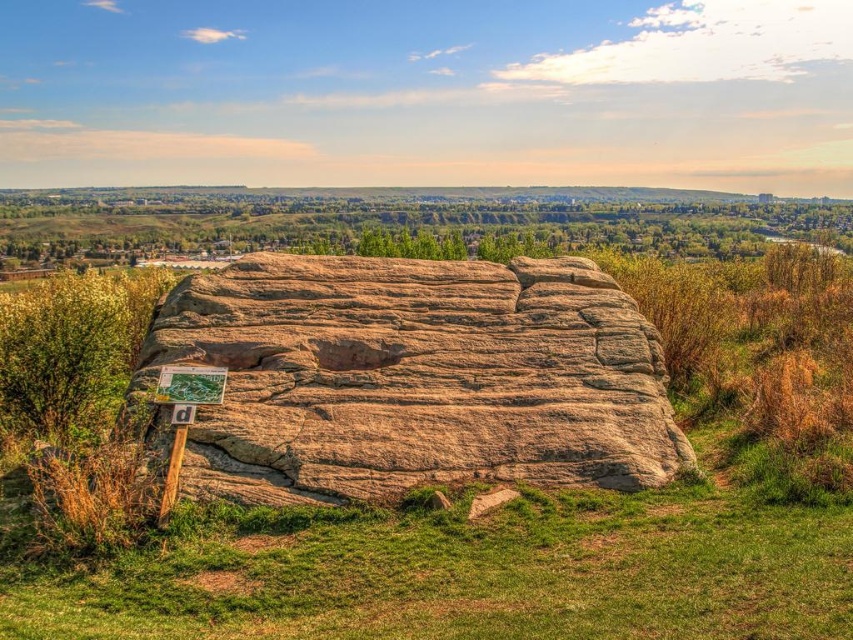
Based on the scene description, where is the point located at coordinates (468, 570)?

The point at coordinates (468, 570) is located on the green grassy area at center.

You are standing at the edge of the grassy area and want to place a small flag exactly between the green grassy at center and the brown textured rock at center. Which object will the flag be closer to?

The flag will be closer to the green grassy at center because it has a lesser height compared to the brown textured rock at center.

You are standing in a park and see the green grassy at center and the brown textured rock at center. Which one is closer to you?

The green grassy at center is closer to you because it is in front of the brown textured rock at center.